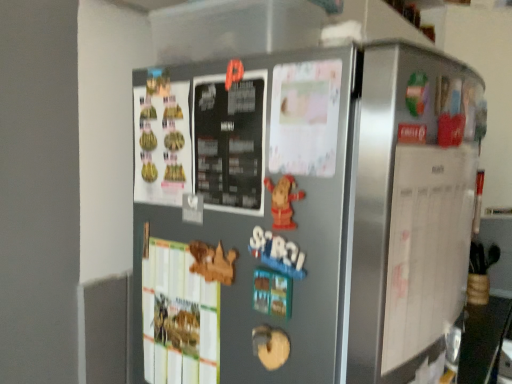
Question: Is white paper at right at the left side of satin silver refrigerator at center?

Choices:
 (A) no
 (B) yes

Answer: (A)

Question: Does white paper at right have a greater height compared to satin silver refrigerator at center?

Choices:
 (A) no
 (B) yes

Answer: (A)

Question: Can we say white paper at right lies outside satin silver refrigerator at center?

Choices:
 (A) yes
 (B) no

Answer: (A)

Question: Is white paper at right closer to camera compared to satin silver refrigerator at center?

Choices:
 (A) no
 (B) yes

Answer: (A)

Question: From a real-world perspective, is white paper at right located higher than satin silver refrigerator at center?

Choices:
 (A) yes
 (B) no

Answer: (A)

Question: From a real-world perspective, is white paper at right positioned under satin silver refrigerator at center based on gravity?

Choices:
 (A) yes
 (B) no

Answer: (B)

Question: Is white paper at right inside satin silver refrigerator at center?

Choices:
 (A) yes
 (B) no

Answer: (B)

Question: Is satin silver refrigerator at center to the left of white paper at right from the viewer's perspective?

Choices:
 (A) yes
 (B) no

Answer: (A)

Question: From a real-world perspective, is satin silver refrigerator at center positioned over white paper at right based on gravity?

Choices:
 (A) yes
 (B) no

Answer: (B)

Question: Can you confirm if satin silver refrigerator at center is thinner than white paper at right?

Choices:
 (A) yes
 (B) no

Answer: (B)

Question: From the image's perspective, is satin silver refrigerator at center beneath white paper at right?

Choices:
 (A) no
 (B) yes

Answer: (B)

Question: Considering the relative positions of satin silver refrigerator at center and white paper at right in the image provided, is satin silver refrigerator at center to the right of white paper at right from the viewer's perspective?

Choices:
 (A) no
 (B) yes

Answer: (A)

Question: Visually, is satin silver refrigerator at center positioned to the left or to the right of white paper at right?

Choices:
 (A) right
 (B) left

Answer: (B)